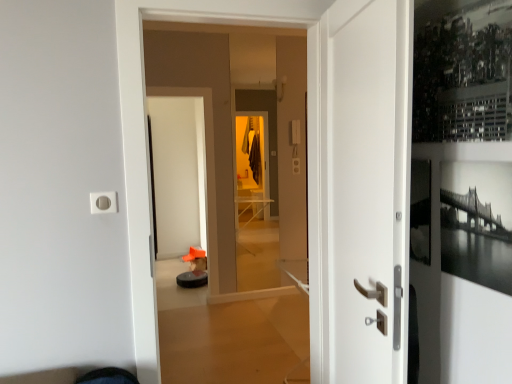
Question: From the image's perspective, would you say white glossy door at center, which is the 1th door from left to right, is positioned over black glossy screen door at center?

Choices:
 (A) no
 (B) yes

Answer: (A)

Question: Is white glossy door at center, the second door positioned from the right, to the left of black glossy screen door at center from the viewer's perspective?

Choices:
 (A) yes
 (B) no

Answer: (B)

Question: Is white glossy door at center, the second door positioned from the right, outside black glossy screen door at center?

Choices:
 (A) no
 (B) yes

Answer: (B)

Question: Does white glossy door at center, the second door positioned from the right, have a lesser width compared to black glossy screen door at center?

Choices:
 (A) yes
 (B) no

Answer: (A)

Question: Is white glossy door at center, which is the 1th door from left to right, taller than black glossy screen door at center?

Choices:
 (A) no
 (B) yes

Answer: (A)

Question: Is white glossy door at center, the second door positioned from the right, smaller than black glossy screen door at center?

Choices:
 (A) yes
 (B) no

Answer: (B)

Question: Does black plastic robot vacuum cleaner at lower center have a lesser height compared to black glossy screen door at center?

Choices:
 (A) no
 (B) yes

Answer: (B)

Question: Can we say black plastic robot vacuum cleaner at lower center lies outside black glossy screen door at center?

Choices:
 (A) no
 (B) yes

Answer: (B)

Question: From a real-world perspective, is black plastic robot vacuum cleaner at lower center located beneath black glossy screen door at center?

Choices:
 (A) yes
 (B) no

Answer: (A)

Question: Considering the relative sizes of black plastic robot vacuum cleaner at lower center and black glossy screen door at center in the image provided, is black plastic robot vacuum cleaner at lower center thinner than black glossy screen door at center?

Choices:
 (A) yes
 (B) no

Answer: (B)

Question: Does black plastic robot vacuum cleaner at lower center have a larger size compared to black glossy screen door at center?

Choices:
 (A) yes
 (B) no

Answer: (B)

Question: Can you confirm if black plastic robot vacuum cleaner at lower center is taller than black glossy screen door at center?

Choices:
 (A) yes
 (B) no

Answer: (B)

Question: Does white matte door at center, positioned as the second door in left-to-right order, appear on the right side of black glossy screen door at center?

Choices:
 (A) yes
 (B) no

Answer: (A)